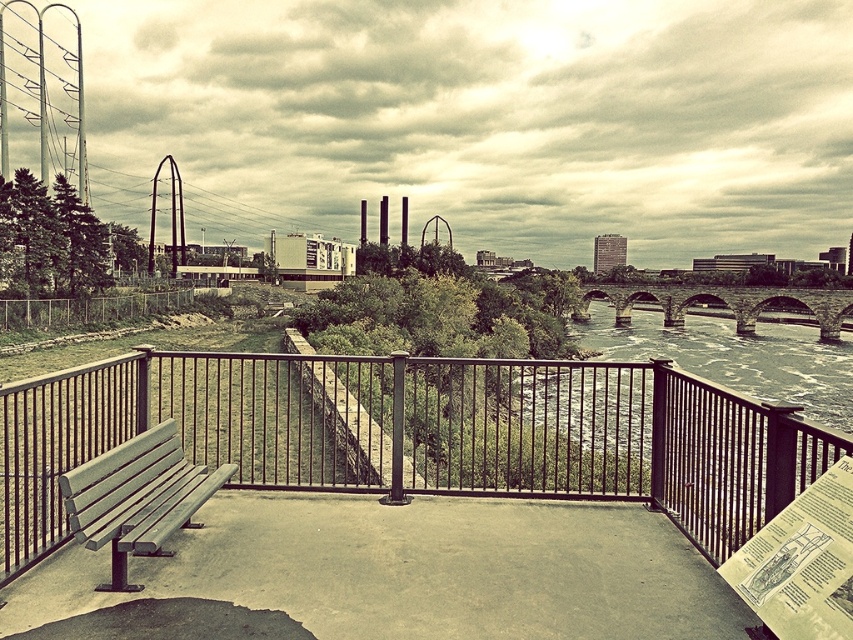
Question: Which point is farther from the camera taking this photo?

Choices:
 (A) (840, 298)
 (B) (62, 477)
 (C) (761, 518)

Answer: (A)

Question: Can you confirm if wooden bench at lower left is positioned to the right of stone arch bridge at right?

Choices:
 (A) yes
 (B) no

Answer: (B)

Question: Which object appears farthest from the camera in this image?

Choices:
 (A) wooden bench at lower left
 (B) stone arch bridge at right

Answer: (B)

Question: Does metal at left appear over stone arch bridge at right?

Choices:
 (A) yes
 (B) no

Answer: (B)

Question: Among these points, which one is farthest from the camera?

Choices:
 (A) (669, 285)
 (B) (184, 506)

Answer: (A)

Question: Considering the relative positions of wooden bench at lower left and stone arch bridge at right in the image provided, where is wooden bench at lower left located with respect to stone arch bridge at right?

Choices:
 (A) above
 (B) below

Answer: (B)